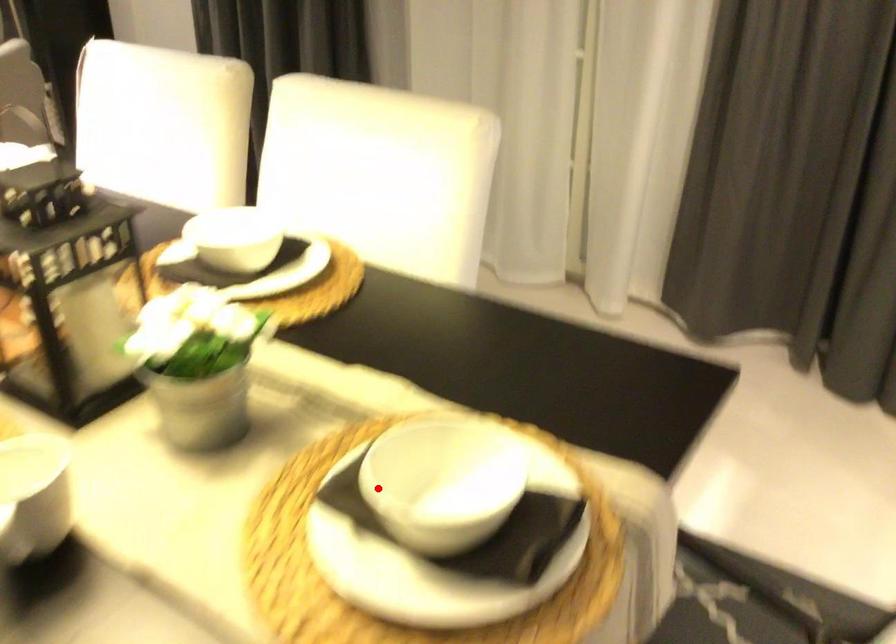
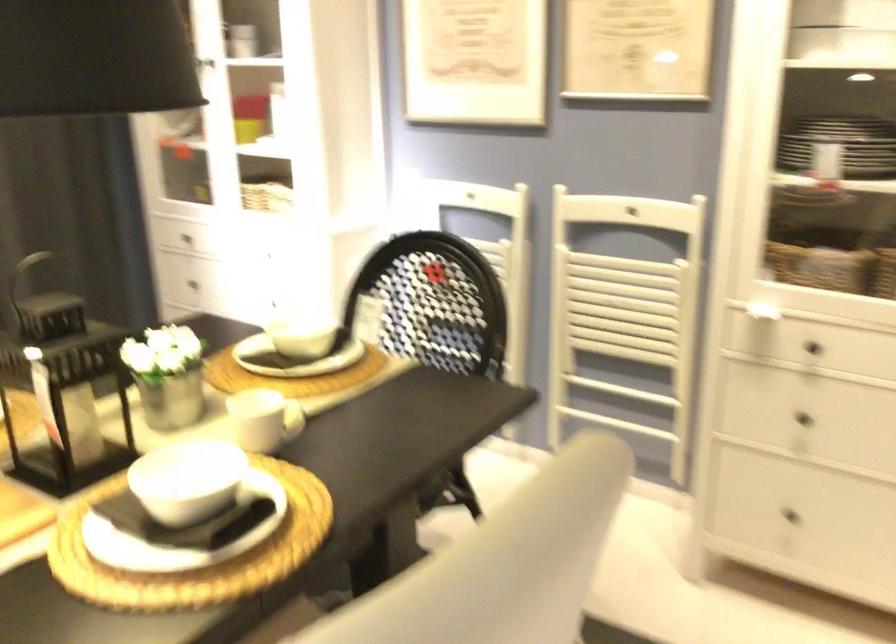
Question: I am providing you with two images of the same scene from different viewpoints. A red point is shown in image1. For the corresponding object point in image2, is it positioned nearer or farther from the camera?

Choices:
 (A) Nearer
 (B) Farther

Answer: (B)